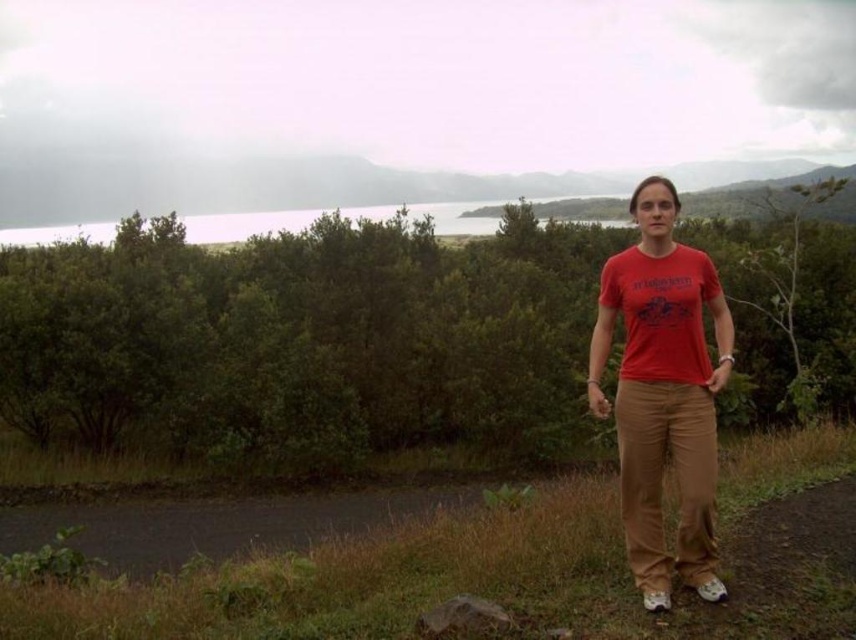
Question: Does red cotton t-shirt at right appear on the right side of matte red t-shirt at center?

Choices:
 (A) yes
 (B) no

Answer: (B)

Question: Is red cotton t-shirt at right further to the viewer compared to matte red t-shirt at center?

Choices:
 (A) yes
 (B) no

Answer: (B)

Question: Which object appears closest to the camera in this image?

Choices:
 (A) matte red t-shirt at center
 (B) red cotton t-shirt at right

Answer: (B)

Question: Can you confirm if red cotton t-shirt at right is wider than matte red t-shirt at center?

Choices:
 (A) yes
 (B) no

Answer: (B)